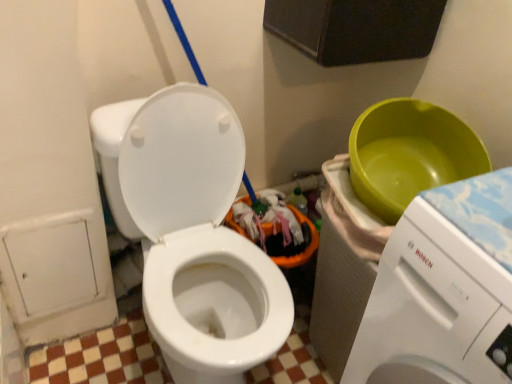
This screenshot has width=512, height=384. Identify the location of white glossy washing machine at right. (443, 291).

What do you see at coordinates (443, 291) in the screenshot? I see `white glossy washing machine at right` at bounding box center [443, 291].

In order to click on white glossy toilet at center in this screenshot , I will do `click(193, 232)`.

What do you see at coordinates (193, 232) in the screenshot?
I see `white glossy toilet at center` at bounding box center [193, 232].

Where is `white glossy washing machine at right`? The height and width of the screenshot is (384, 512). white glossy washing machine at right is located at coordinates (443, 291).

Which is more to the right, white glossy washing machine at right or white glossy toilet at center?

Positioned to the right is white glossy washing machine at right.

Considering the relative positions of white glossy washing machine at right and white glossy toilet at center in the image provided, is white glossy washing machine at right in front of white glossy toilet at center?

Yes, the depth of white glossy washing machine at right is less than that of white glossy toilet at center.

Between point (430, 355) and point (177, 159), which one is positioned in front?

The point (430, 355) is closer to the camera.

From the image's perspective, is white glossy washing machine at right over white glossy toilet at center?

Incorrect, from the image's perspective, white glossy washing machine at right is lower than white glossy toilet at center.

From a real-world perspective, is white glossy washing machine at right positioned above or below white glossy toilet at center?

white glossy washing machine at right is below white glossy toilet at center.

Looking at their sizes, would you say white glossy washing machine at right is wider or thinner than white glossy toilet at center?

white glossy washing machine at right is wider than white glossy toilet at center.

Consider the image. Considering the sizes of objects white glossy washing machine at right and white glossy toilet at center in the image provided, who is taller, white glossy washing machine at right or white glossy toilet at center?

white glossy washing machine at right is taller.

Who is smaller, white glossy washing machine at right or white glossy toilet at center?

white glossy washing machine at right is smaller.

Is white glossy washing machine at right inside the boundaries of white glossy toilet at center, or outside?

white glossy washing machine at right lies outside white glossy toilet at center.

Is white glossy washing machine at right next to white glossy toilet at center and touching it?

No, white glossy washing machine at right is not beside white glossy toilet at center.

Is white glossy washing machine at right turned away from white glossy toilet at center?

No, white glossy washing machine at right is not facing the opposite direction of white glossy toilet at center.

You are a GUI agent. You are given a task and a screenshot of the screen. Output one action in this format:
    pyautogui.click(x=<x>, y=<y>)
    Task: Click on the toilet above the white glossy washing machine at right (from the image's perspective)
    The height and width of the screenshot is (384, 512).
    Given the screenshot: What is the action you would take?
    pyautogui.click(x=193, y=232)

Is white glossy toilet at center at the left side of white glossy washing machine at right?

Yes, white glossy toilet at center is to the left of white glossy washing machine at right.

Is the depth of white glossy toilet at center greater than that of white glossy washing machine at right?

Yes, it is behind white glossy washing machine at right.

Considering the positions of point (282, 326) and point (408, 331), is point (282, 326) closer or farther from the camera than point (408, 331)?

Clearly, point (282, 326) is more distant from the camera than point (408, 331).

From the image's perspective, between white glossy toilet at center and white glossy washing machine at right, who is located below?

From the image's view, white glossy washing machine at right is below.

From a real-world perspective, is white glossy toilet at center positioned above or below white glossy washing machine at right?

In terms of real-world spatial position, white glossy toilet at center is above white glossy washing machine at right.

Looking at their sizes, would you say white glossy toilet at center is wider or thinner than white glossy washing machine at right?

Clearly, white glossy toilet at center has less width compared to white glossy washing machine at right.

Is white glossy toilet at center taller than white glossy washing machine at right?

No, white glossy toilet at center is not taller than white glossy washing machine at right.

Looking at the image, does white glossy toilet at center seem bigger or smaller compared to white glossy washing machine at right?

Clearly, white glossy toilet at center is larger in size than white glossy washing machine at right.

Is white glossy washing machine at right completely or partially inside white glossy toilet at center?

No.

Is white glossy toilet at center far from white glossy washing machine at right?

They are positioned close to each other.

Is white glossy toilet at center looking in the opposite direction of white glossy washing machine at right?

No, white glossy toilet at center is not facing away from white glossy washing machine at right.

Consider the image. Can you tell me how much white glossy toilet at center and white glossy washing machine at right differ in facing direction?

white glossy toilet at center and white glossy washing machine at right are facing 92.2 degrees away from each other.

This screenshot has height=384, width=512. In order to click on washing machine below the white glossy toilet at center (from a real-world perspective) in this screenshot , I will do (443, 291).

The height and width of the screenshot is (384, 512). In order to click on toilet on the left of white glossy washing machine at right in this screenshot , I will do (193, 232).

At what (x,y) coordinates should I click in order to perform the action: click on washing machine that appears on the right of white glossy toilet at center. Please return your answer as a coordinate pair (x, y). The image size is (512, 384). Looking at the image, I should click on (443, 291).